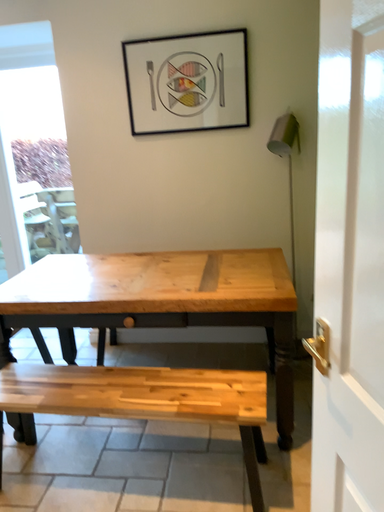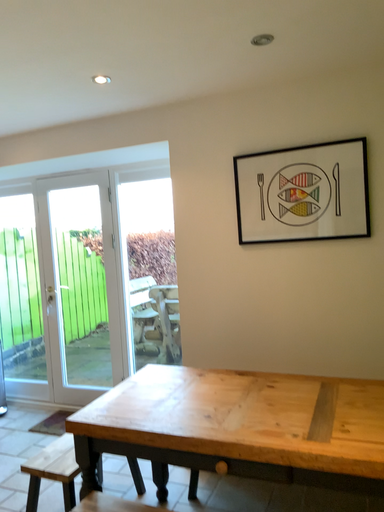
Question: Which way did the camera rotate in the video?

Choices:
 (A) rotated upward
 (B) rotated downward

Answer: (A)